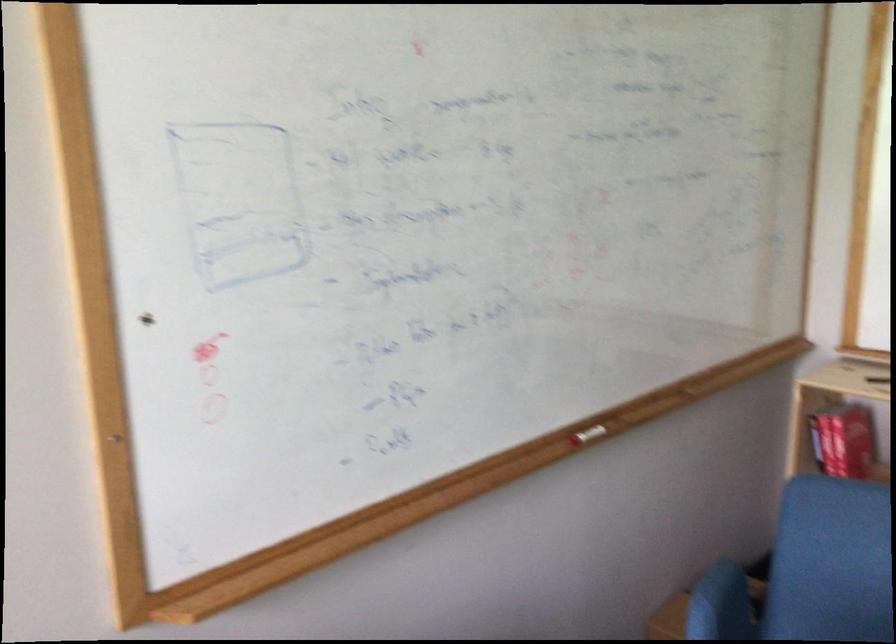
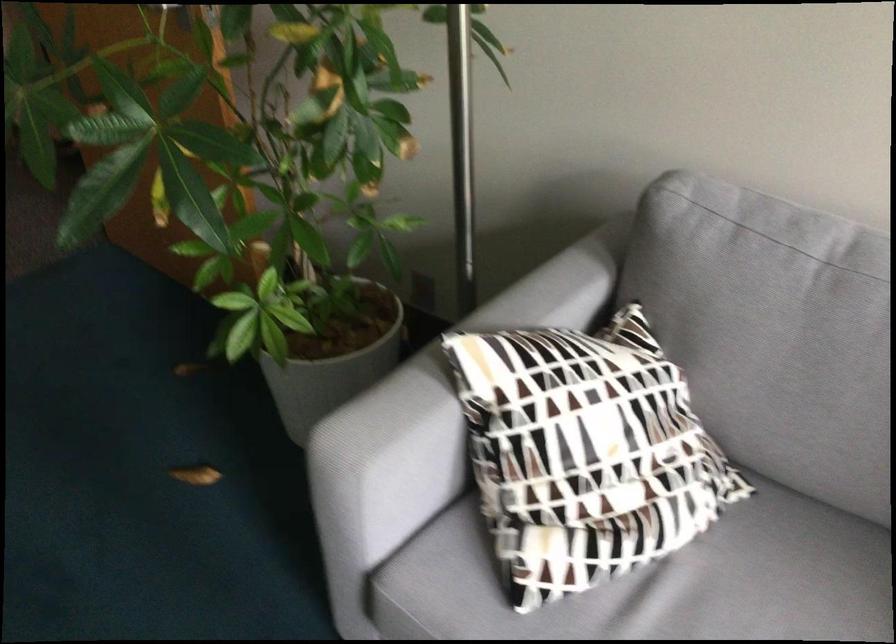
The first image is from the beginning of the video and the second image is from the end. How did the camera likely rotate when shooting the video?

The camera rotated toward right-down.